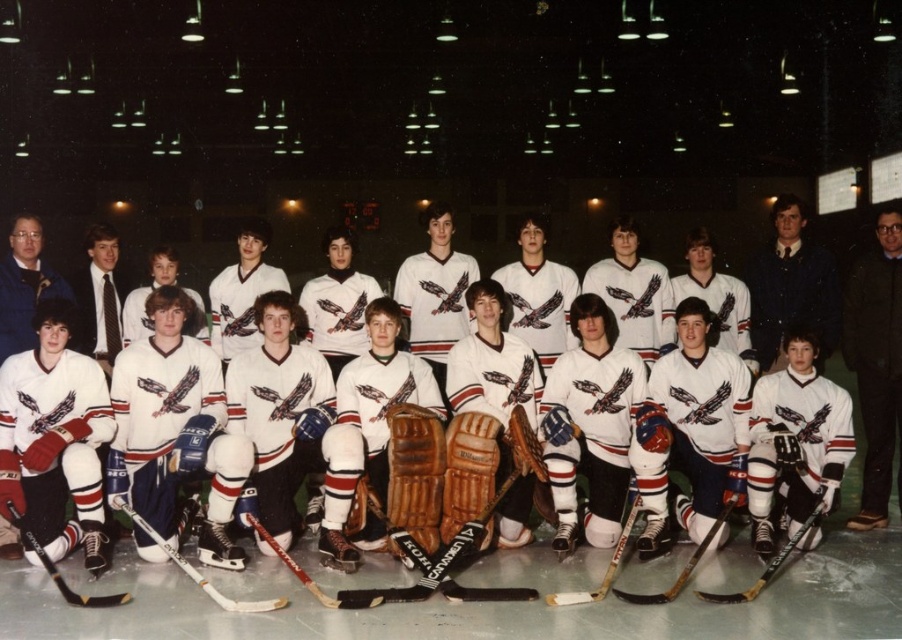
Does white matte hockey jerseys at center have a greater width compared to dark blue suit at center?

No.

Does white matte hockey jerseys at center appear under dark blue suit at center?

Yes.

Who is more forward, (277, 326) or (812, 307)?

Point (277, 326) is more forward.

Identify the location of white matte hockey jerseys at center. This screenshot has width=902, height=640. (693, 326).

Can you confirm if brown leather hockey stick at center is positioned to the right of red glossy hockey stick at lower left?

Indeed, brown leather hockey stick at center is positioned on the right side of red glossy hockey stick at lower left.

Who is positioned more to the left, brown leather hockey stick at center or red glossy hockey stick at lower left?

From the viewer's perspective, red glossy hockey stick at lower left appears more on the left side.

Is point (472, 592) closer to camera compared to point (268, 604)?

That is False.

You are a GUI agent. You are given a task and a screenshot of the screen. Output one action in this format:
    pyautogui.click(x=<x>, y=<y>)
    Task: Click on the brown leather hockey stick at center
    The width and height of the screenshot is (902, 640).
    Given the screenshot: What is the action you would take?
    pyautogui.click(x=451, y=564)

Between point (861, 500) and point (775, 566), which one is positioned in front?

Point (775, 566)

Is point (879, 388) less distant than point (811, 522)?

No, (879, 388) is behind (811, 522).

Between point (890, 376) and point (781, 552), which one is positioned behind?

The point (890, 376) is behind.

The width and height of the screenshot is (902, 640). I want to click on black leather jacket at right, so click(876, 364).